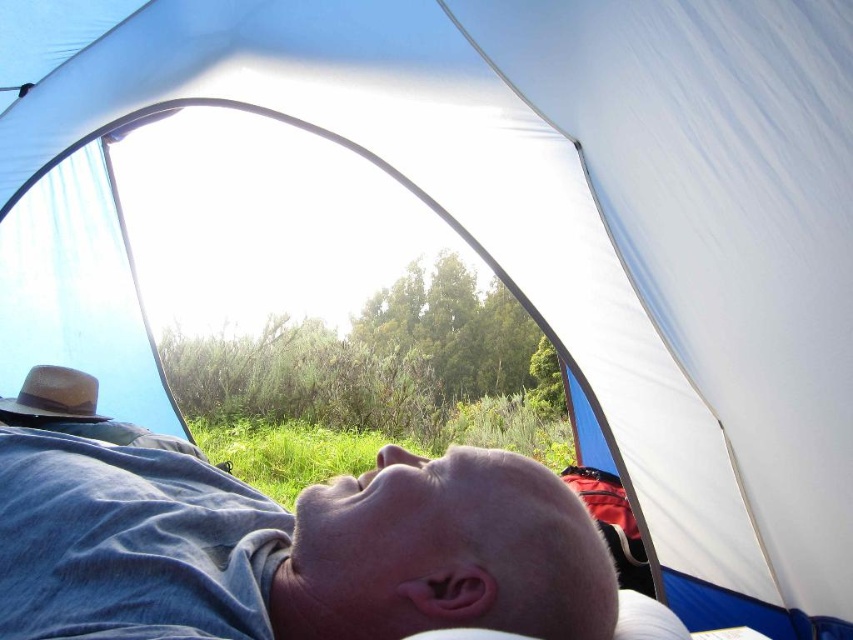
Question: Where is smooth skin head at lower center located in relation to brown straw hat at left in the image?

Choices:
 (A) above
 (B) below

Answer: (A)

Question: Can you confirm if smooth skin head at lower center is positioned above brown straw hat at left?

Choices:
 (A) no
 (B) yes

Answer: (B)

Question: Can you confirm if smooth skin head at lower center is wider than brown straw hat at left?

Choices:
 (A) no
 (B) yes

Answer: (B)

Question: Which object is farther from the camera taking this photo?

Choices:
 (A) smooth skin head at lower center
 (B) brown straw hat at left

Answer: (B)

Question: Among these objects, which one is nearest to the camera?

Choices:
 (A) brown straw hat at left
 (B) smooth skin head at lower center

Answer: (B)